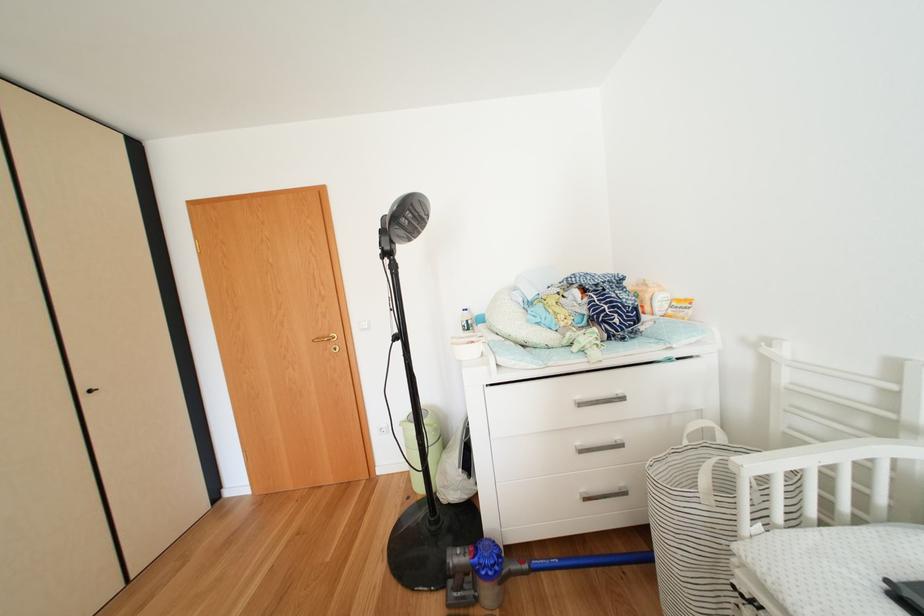
What do you see at coordinates (94, 390) in the screenshot? I see `the black cabinet handle` at bounding box center [94, 390].